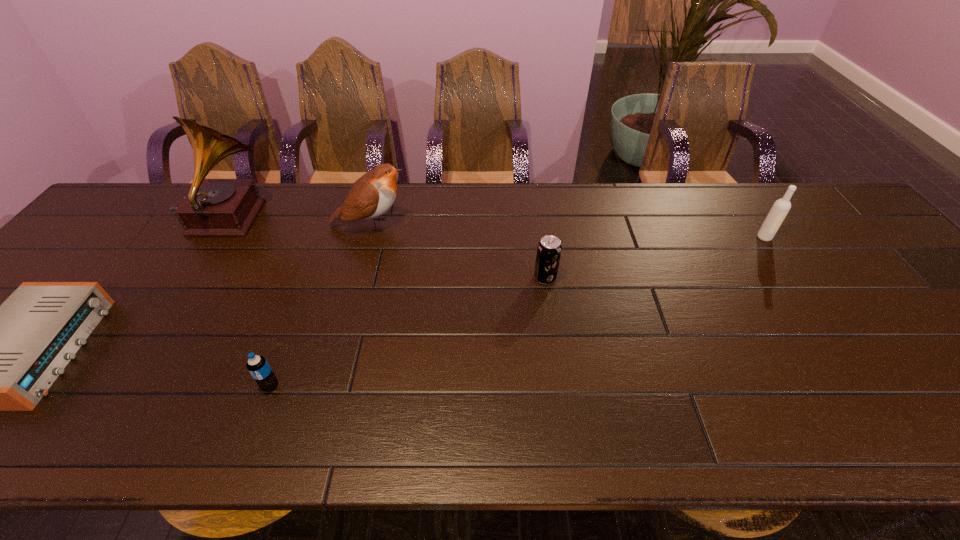
Locate an element on the screen. The width and height of the screenshot is (960, 540). the tallest object is located at coordinates (213, 207).

Where is `bird`? This screenshot has width=960, height=540. bird is located at coordinates (372, 195).

Identify the location of the rightmost object. (781, 207).

Identify the location of the fourth shortest object. The width and height of the screenshot is (960, 540). (781, 207).

The image size is (960, 540). I want to click on the farther soda bottle, so click(549, 249).

Locate an element on the screen. This screenshot has width=960, height=540. the fourth farthest object is located at coordinates (549, 249).

Find the location of a particular element. the left soda bottle is located at coordinates (257, 365).

At what (x,y) coordinates should I click in order to perform the action: click on free location located from the horn of the tallest object. Please return your answer as a coordinate pair (x, y). The image size is (960, 540). Looking at the image, I should click on (372, 220).

Where is `free space located at the face of the bird`? The image size is (960, 540). free space located at the face of the bird is located at coordinates (523, 225).

In order to click on free region located 0.280m on the right of the vodka in this screenshot , I will do `click(870, 238)`.